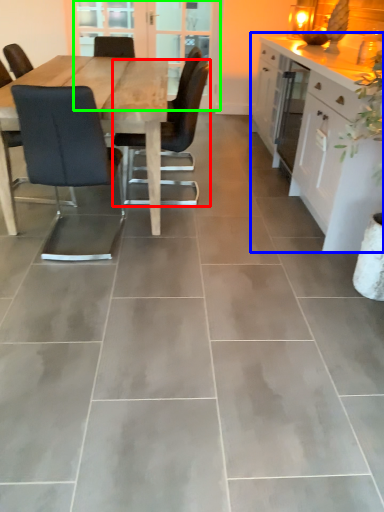
Question: Which object is the closest to the chair (highlighted by a red box)? Choose among these: cabinetry (highlighted by a blue box) or screen door (highlighted by a green box).

Choices:
 (A) cabinetry
 (B) screen door

Answer: (A)